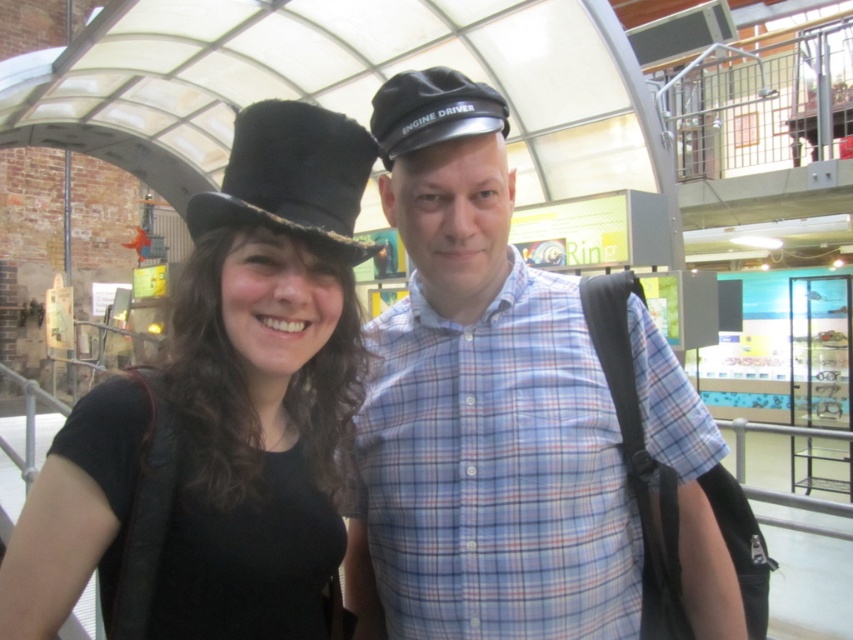
Question: Which point is farther from the camera taking this photo?

Choices:
 (A) (340, 202)
 (B) (408, 90)

Answer: (B)

Question: Where is blue plaid shirt at center located in relation to black fabric cap at center in the image?

Choices:
 (A) above
 (B) below

Answer: (B)

Question: Is blue plaid shirt at center to the right of black fabric cap at center from the viewer's perspective?

Choices:
 (A) no
 (B) yes

Answer: (B)

Question: Can you confirm if matte black hat at left is smaller than black fabric cap at center?

Choices:
 (A) no
 (B) yes

Answer: (A)

Question: Estimate the real-world distances between objects in this image. Which object is farther from the blue plaid shirt at center?

Choices:
 (A) matte black hat at left
 (B) black felt dress hat at upper left

Answer: (B)

Question: Which point appears closest to the camera in this image?

Choices:
 (A) (398, 86)
 (B) (318, 484)

Answer: (B)